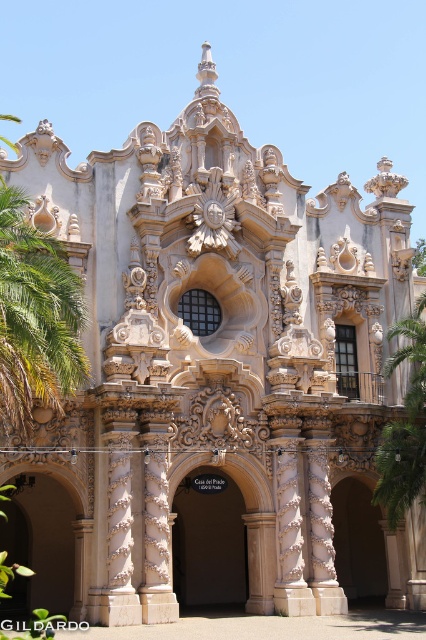
Question: Which is farther from the green leafy palm tree at left?

Choices:
 (A) green leafy palm tree at right
 (B) brown stone archway at center

Answer: (A)

Question: Among these points, which one is farthest from the camera?

Choices:
 (A) (8, 356)
 (B) (221, 552)

Answer: (B)

Question: Is brown stone archway at center bigger than green leafy palm tree at right?

Choices:
 (A) yes
 (B) no

Answer: (A)

Question: Can you confirm if green leafy palm tree at left is positioned to the right of brown stone archway at center?

Choices:
 (A) no
 (B) yes

Answer: (A)

Question: Which object appears farthest from the camera in this image?

Choices:
 (A) green leafy palm tree at right
 (B) green leafy palm tree at left

Answer: (A)

Question: Can you confirm if green leafy palm tree at left is bigger than brown stone archway at center?

Choices:
 (A) yes
 (B) no

Answer: (A)